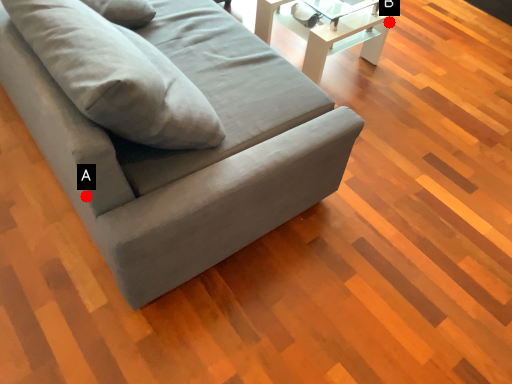
Question: Two points are circled on the image, labeled by A and B beside each circle. Which point is closer to the camera?

Choices:
 (A) A is closer
 (B) B is closer

Answer: (A)